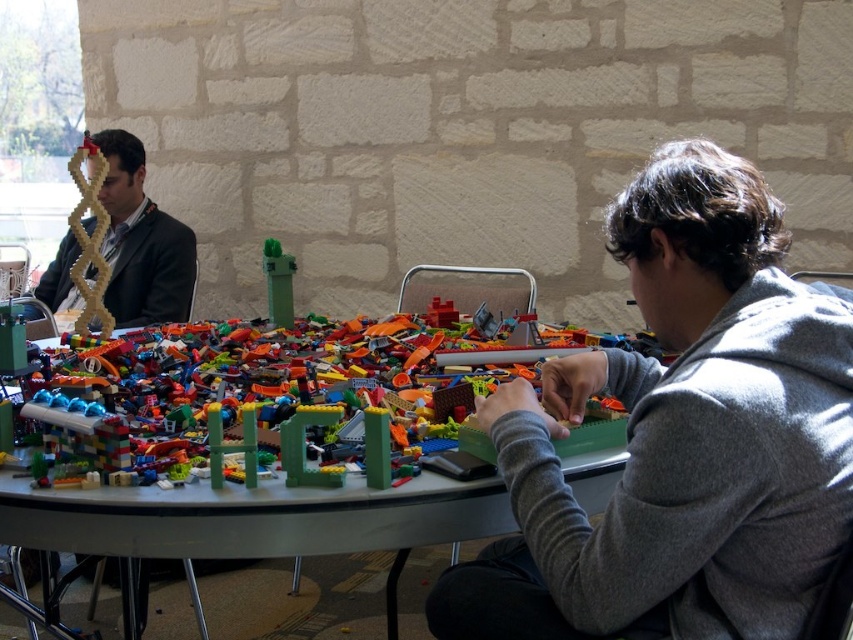
Question: Which point is farther from the camera taking this photo?

Choices:
 (A) (782, 522)
 (B) (114, 282)
 (C) (477, 432)

Answer: (B)

Question: Which point is farther to the camera?

Choices:
 (A) matte black suit at left
 (B) multicolored plastic lego bricks at center
 (C) translucent plastic lego bricks at center

Answer: (A)

Question: Can you confirm if gray fleece at right is wider than multicolored plastic lego bricks at center?

Choices:
 (A) no
 (B) yes

Answer: (A)

Question: Can you confirm if multicolored plastic lego bricks at center is positioned above matte black suit at left?

Choices:
 (A) no
 (B) yes

Answer: (A)

Question: Is gray fleece at right smaller than multicolored plastic lego bricks at center?

Choices:
 (A) yes
 (B) no

Answer: (B)

Question: Based on their relative distances, which object is nearer to the gray fleece at right?

Choices:
 (A) multicolored plastic lego bricks at center
 (B) matte black suit at left

Answer: (A)